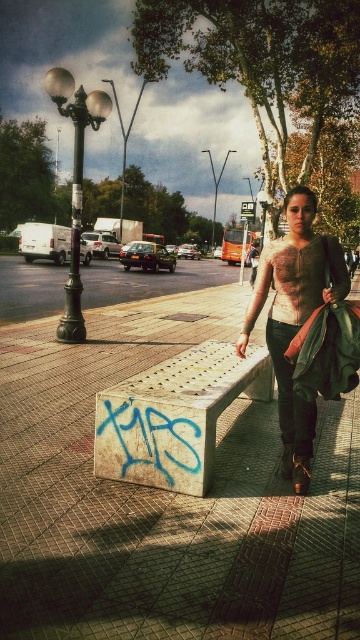
You are a delivery person who needs to place a large package on the concrete bench at center and the textured beige sweater at center. Which object can you place the package on?

The concrete bench at center is larger in size than the textured beige sweater at center, so the package can be placed on the concrete bench at center.

You are standing at the point labeled point (x=244, y=324) and want to walk to the point labeled point (x=159, y=396). According to the scene, which direction should you move in?

You should move forward because point (x=159, y=396) is in front of point (x=244, y=324).

You are designing a new park layout and want to place a bench that can accommodate more people. Based on the image, which bench between the concrete bench at center and the white textured bench at center should you choose?

The concrete bench at center is bigger than the white textured bench at center, so you should choose the concrete bench at center to accommodate more people.